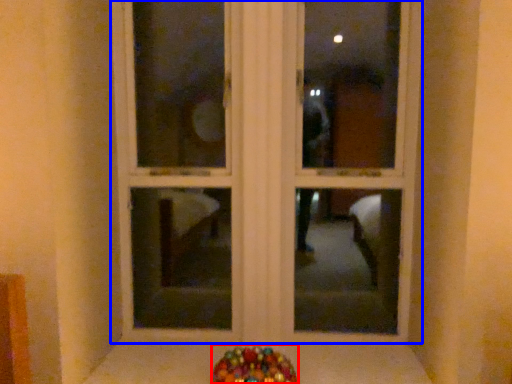
Question: Which object appears farthest to the camera in this image, candy (highlighted by a red box) or window frame (highlighted by a blue box)?

Choices:
 (A) candy
 (B) window frame

Answer: (B)